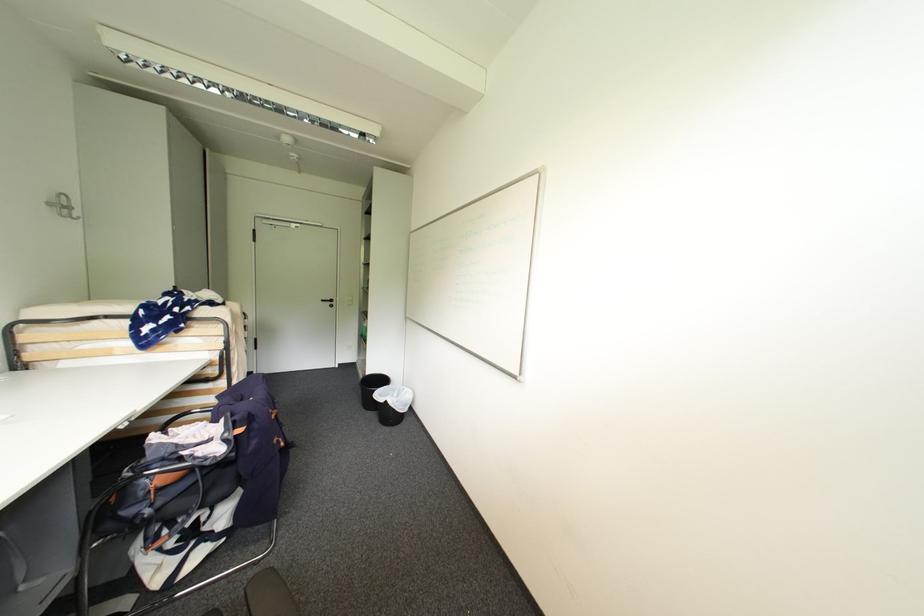
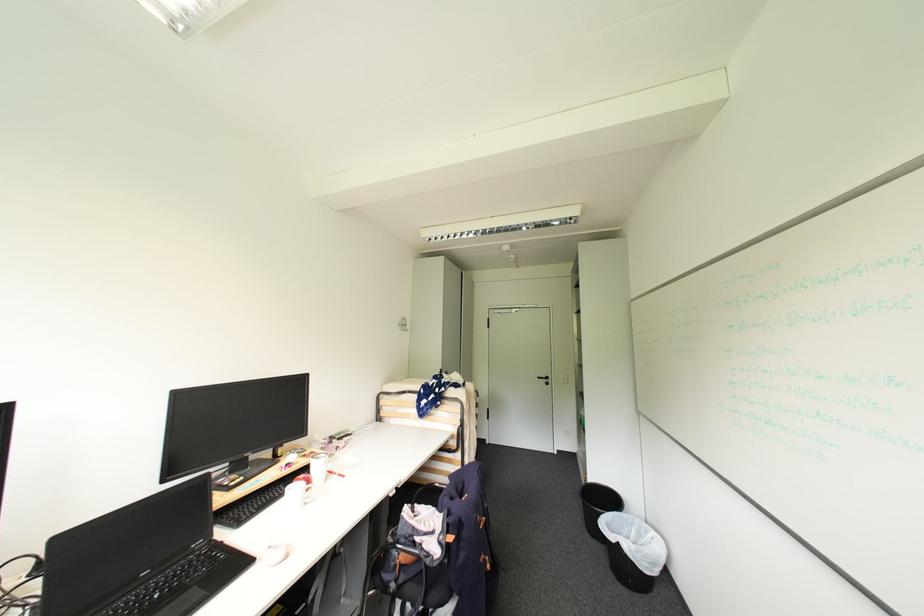
Where in the second image is the point corresponding to [393,387] from the first image?

(624, 514)